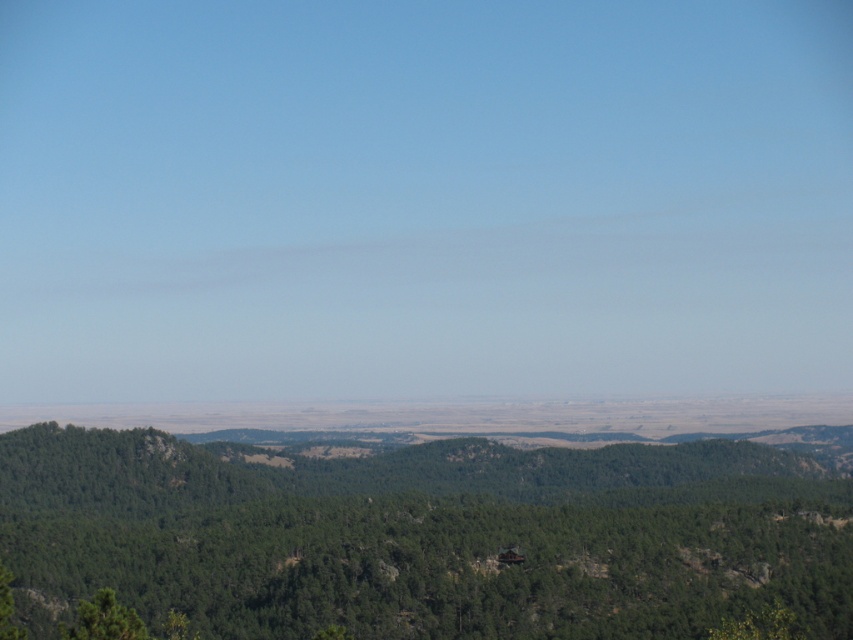
Who is positioned more to the right, green leafy tree at center or green matte tree at lower left?

Positioned to the right is green leafy tree at center.

Can you confirm if green leafy tree at center is thinner than green matte tree at lower left?

Incorrect, green leafy tree at center's width is not less than green matte tree at lower left's.

The height and width of the screenshot is (640, 853). What are the coordinates of `green leafy tree at center` in the screenshot? It's located at (426, 536).